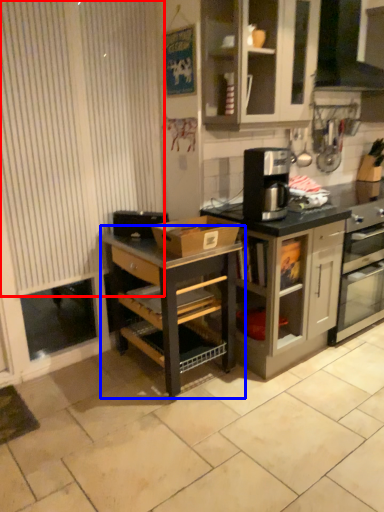
Question: Which object is closer to the camera taking this photo, curtain (highlighted by a red box) or shelf (highlighted by a blue box)?

Choices:
 (A) curtain
 (B) shelf

Answer: (A)